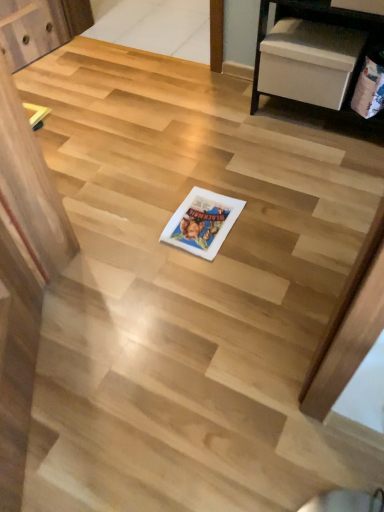
Question: Is point (231, 202) closer or farther from the camera than point (367, 73)?

Choices:
 (A) farther
 (B) closer

Answer: (A)

Question: From the image's perspective, is white paper comic book at center, which ranks as the first comic book in bottom-to-top order, positioned above or below matte paper comic book at right, the 2th comic book when ordered from bottom to top?

Choices:
 (A) above
 (B) below

Answer: (B)

Question: From a real-world perspective, is white paper comic book at center, which ranks as the first comic book in bottom-to-top order, positioned above or below matte paper comic book at right, positioned as the second comic book in left-to-right order?

Choices:
 (A) below
 (B) above

Answer: (A)

Question: Relative to white paper comic book at center, which ranks as the first comic book in bottom-to-top order, is matte paper comic book at right, positioned as the second comic book in left-to-right order, in front or behind?

Choices:
 (A) front
 (B) behind

Answer: (B)

Question: Do you think matte paper comic book at right, the 2th comic book when ordered from bottom to top, is within white paper comic book at center, the 2th comic book in the right-to-left sequence, or outside of it?

Choices:
 (A) outside
 (B) inside

Answer: (A)

Question: Looking at the image, does matte paper comic book at right, which is the 1th comic book from top to bottom, seem bigger or smaller compared to white paper comic book at center, which ranks as the first comic book in bottom-to-top order?

Choices:
 (A) big
 (B) small

Answer: (A)

Question: From a real-world perspective, is matte paper comic book at right, positioned as the second comic book in left-to-right order, physically located above or below white paper comic book at center, the 2th comic book when ordered from top to bottom?

Choices:
 (A) below
 (B) above

Answer: (B)